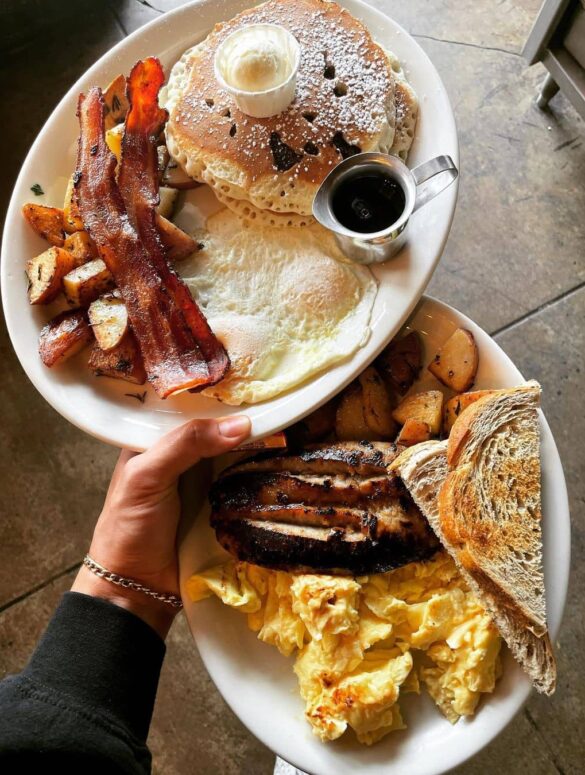
Locate an element on the screen. This screenshot has height=775, width=585. tile is located at coordinates (212, 742).